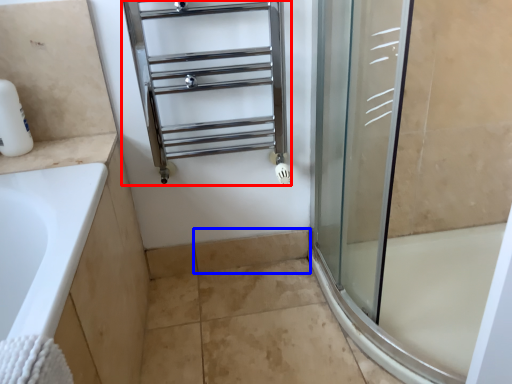
Question: Among these objects, which one is farthest to the camera, shelf (highlighted by a red box) or tile (highlighted by a blue box)?

Choices:
 (A) shelf
 (B) tile

Answer: (B)